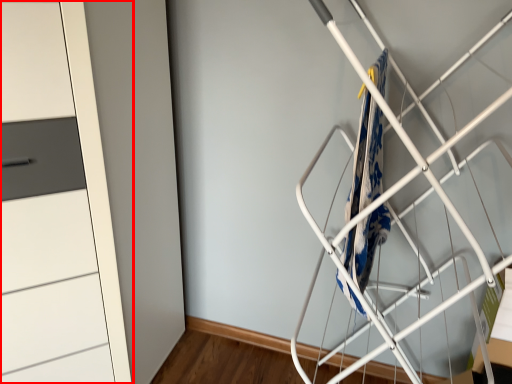
Question: Considering the relative positions of cupboard (annotated by the red box) and blanket in the image provided, where is cupboard (annotated by the red box) located with respect to the staircase?

Choices:
 (A) left
 (B) right

Answer: (A)